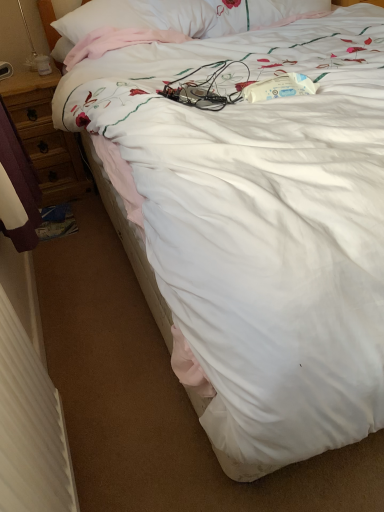
Question: From the image's perspective, is white textured radiator at lower left on top of wooden desk at left?

Choices:
 (A) yes
 (B) no

Answer: (B)

Question: Is the position of white textured radiator at lower left less distant than that of wooden desk at left?

Choices:
 (A) no
 (B) yes

Answer: (B)

Question: Is white textured radiator at lower left to the left of wooden desk at left from the viewer's perspective?

Choices:
 (A) no
 (B) yes

Answer: (A)

Question: From a real-world perspective, is white textured radiator at lower left over wooden desk at left?

Choices:
 (A) yes
 (B) no

Answer: (A)

Question: Could you tell me if white textured radiator at lower left is turned towards wooden desk at left?

Choices:
 (A) yes
 (B) no

Answer: (B)

Question: Is white textured radiator at lower left completely or partially outside of wooden desk at left?

Choices:
 (A) yes
 (B) no

Answer: (A)

Question: Could you tell me if wooden desk at left is turned towards white textured radiator at lower left?

Choices:
 (A) yes
 (B) no

Answer: (A)

Question: Is wooden desk at left thinner than white textured radiator at lower left?

Choices:
 (A) yes
 (B) no

Answer: (B)

Question: Does wooden desk at left lie in front of white textured radiator at lower left?

Choices:
 (A) no
 (B) yes

Answer: (A)

Question: Is wooden desk at left not near white textured radiator at lower left?

Choices:
 (A) no
 (B) yes

Answer: (B)

Question: Is wooden desk at left directly adjacent to white textured radiator at lower left?

Choices:
 (A) no
 (B) yes

Answer: (A)

Question: From the image's perspective, is wooden desk at left beneath white textured radiator at lower left?

Choices:
 (A) no
 (B) yes

Answer: (A)

Question: Is wooden desk at left in front of or behind white textured radiator at lower left in the image?

Choices:
 (A) behind
 (B) front

Answer: (A)